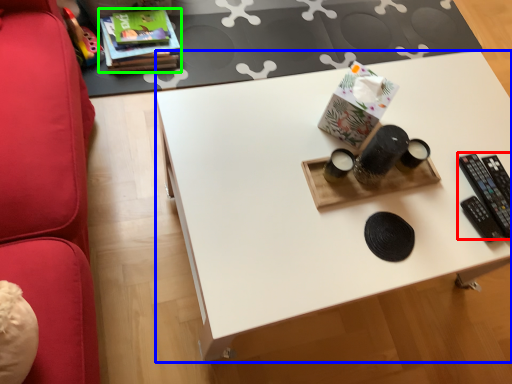
Question: Considering the real-world distances, which object is closest to control (highlighted by a red box)? desk (highlighted by a blue box) or book (highlighted by a green box).

Choices:
 (A) desk
 (B) book

Answer: (A)